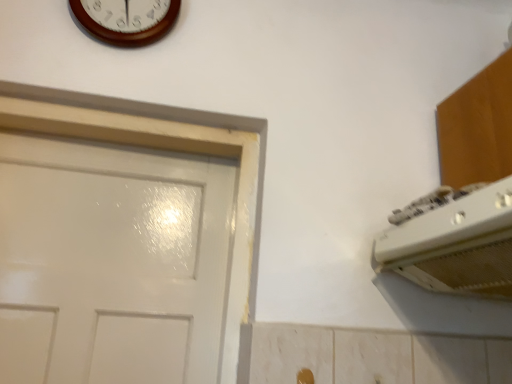
Question: From a real-world perspective, is gold metallic door handle at lower center under white plastic air conditioner at upper right?

Choices:
 (A) no
 (B) yes

Answer: (B)

Question: Can you confirm if gold metallic door handle at lower center is positioned to the right of white plastic air conditioner at upper right?

Choices:
 (A) yes
 (B) no

Answer: (B)

Question: Is gold metallic door handle at lower center wider than white plastic air conditioner at upper right?

Choices:
 (A) yes
 (B) no

Answer: (B)

Question: Can you confirm if gold metallic door handle at lower center is smaller than white plastic air conditioner at upper right?

Choices:
 (A) yes
 (B) no

Answer: (A)

Question: From the image's perspective, does gold metallic door handle at lower center appear higher than white plastic air conditioner at upper right?

Choices:
 (A) yes
 (B) no

Answer: (B)

Question: Could you tell me if gold metallic door handle at lower center is facing white plastic air conditioner at upper right?

Choices:
 (A) no
 (B) yes

Answer: (A)

Question: Is white plastic air conditioner at upper right beside wooden wall clock at upper center?

Choices:
 (A) yes
 (B) no

Answer: (B)

Question: Does white plastic air conditioner at upper right have a greater height compared to wooden wall clock at upper center?

Choices:
 (A) no
 (B) yes

Answer: (A)

Question: Is wooden wall clock at upper center located within white plastic air conditioner at upper right?

Choices:
 (A) yes
 (B) no

Answer: (B)

Question: From the image's perspective, is white plastic air conditioner at upper right located beneath wooden wall clock at upper center?

Choices:
 (A) yes
 (B) no

Answer: (A)

Question: Does white plastic air conditioner at upper right have a larger size compared to wooden wall clock at upper center?

Choices:
 (A) yes
 (B) no

Answer: (A)

Question: Does white plastic air conditioner at upper right lie behind wooden wall clock at upper center?

Choices:
 (A) yes
 (B) no

Answer: (B)

Question: Is wooden wall clock at upper center positioned in front of gold metallic door handle at lower center?

Choices:
 (A) yes
 (B) no

Answer: (B)